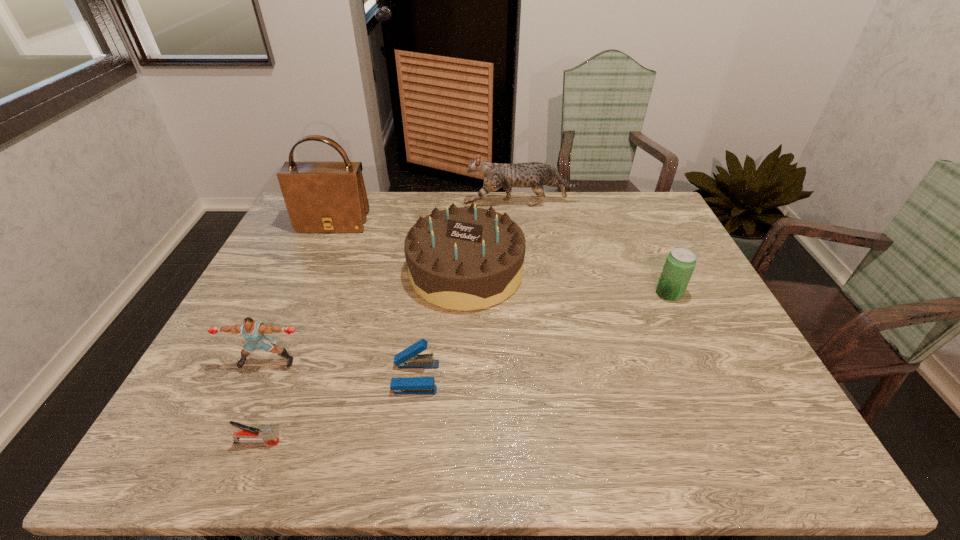
What are the coordinates of `the tallest object` in the screenshot? It's located at (320, 196).

In order to click on shoulder bag in this screenshot , I will do `click(320, 196)`.

Locate an element on the screen. The height and width of the screenshot is (540, 960). the farthest object is located at coordinates click(x=534, y=175).

This screenshot has width=960, height=540. Find the location of `birthday cake`. birthday cake is located at coordinates (463, 258).

Image resolution: width=960 pixels, height=540 pixels. In order to click on puncher in this screenshot , I will do `click(253, 331)`.

Identify the location of soda. The image size is (960, 540). (680, 263).

The height and width of the screenshot is (540, 960). I want to click on the right stapler, so click(x=407, y=359).

The width and height of the screenshot is (960, 540). In order to click on the nearer stapler in this screenshot , I will do `click(248, 435)`.

At what (x,y) coordinates should I click in order to perform the action: click on the nearest object. Please return your answer as a coordinate pair (x, y). Looking at the image, I should click on (248, 435).

Where is `free location located 0.140m on the front flap of the second farthest object`? free location located 0.140m on the front flap of the second farthest object is located at coordinates (317, 262).